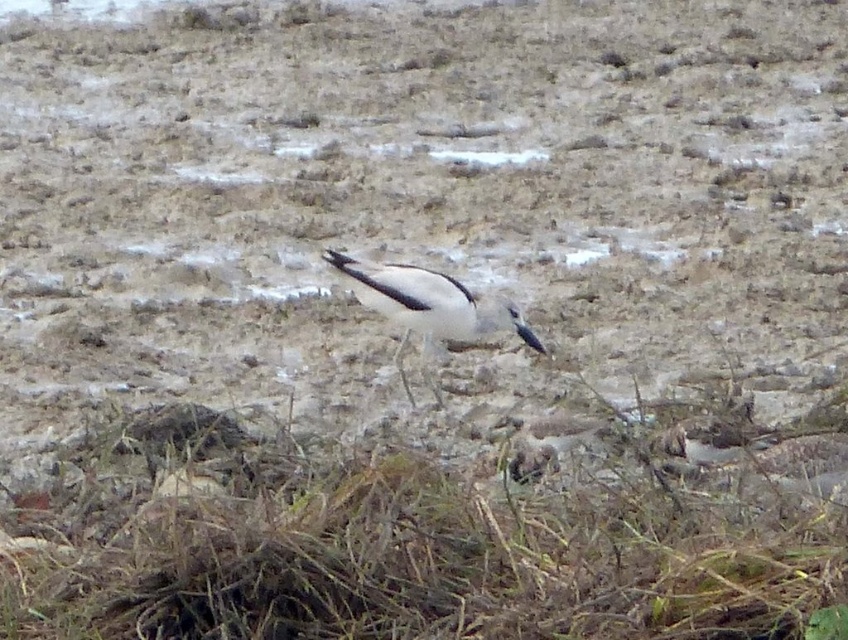
Question: Is brown dry grass at lower center wider than white matte bird at center?

Choices:
 (A) no
 (B) yes

Answer: (B)

Question: Is brown dry grass at lower center to the left of white matte bird at center from the viewer's perspective?

Choices:
 (A) yes
 (B) no

Answer: (B)

Question: From the image, what is the correct spatial relationship of brown dry grass at lower center in relation to white matte bird at center?

Choices:
 (A) below
 (B) above

Answer: (A)